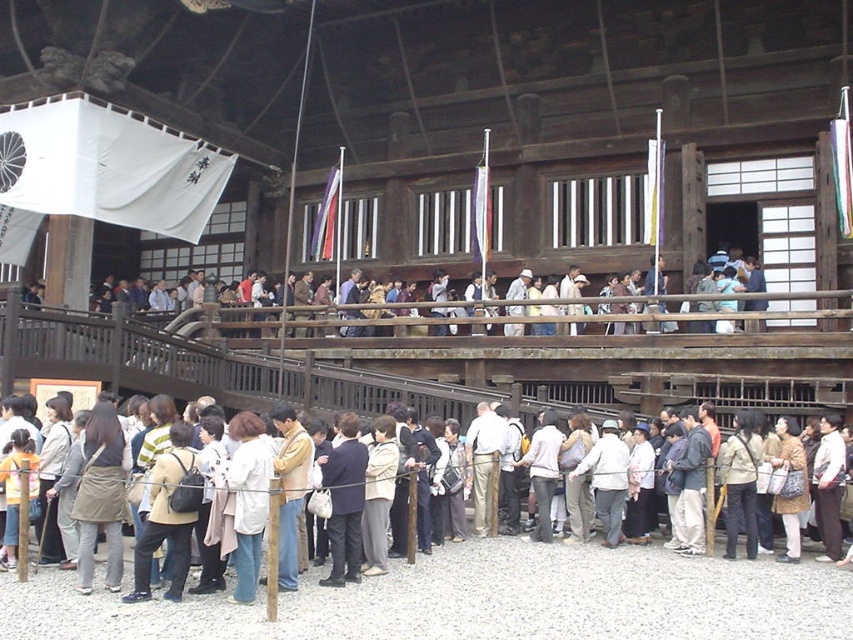
You are standing at the entrance of the temple and want to find the light brown wooden railing at upper center. According to the coordinates provided, where would you look to locate point (680, 304)?

Point (680, 304) is located on the light brown wooden railing at upper center.

From the picture: You are a visitor at the temple and want to lean against the light brown wooden railing at upper center. However, you are wearing a matte beige coat at center. Will your coat touch the ground when you lean against the railing?

The light brown wooden railing at upper center is shorter than the matte beige coat at center, so when you lean against it, the coat will hang below the railing and touch the ground.

Consider the image. You are standing at the entrance of the temple and want to reach the main hall. There is a light brown wooden railing at upper center and a matte beige coat at center in your way. Which object is closer to you that you need to navigate around first?

The light brown wooden railing at upper center is closer to you than the matte beige coat at center, so you need to navigate around it first.